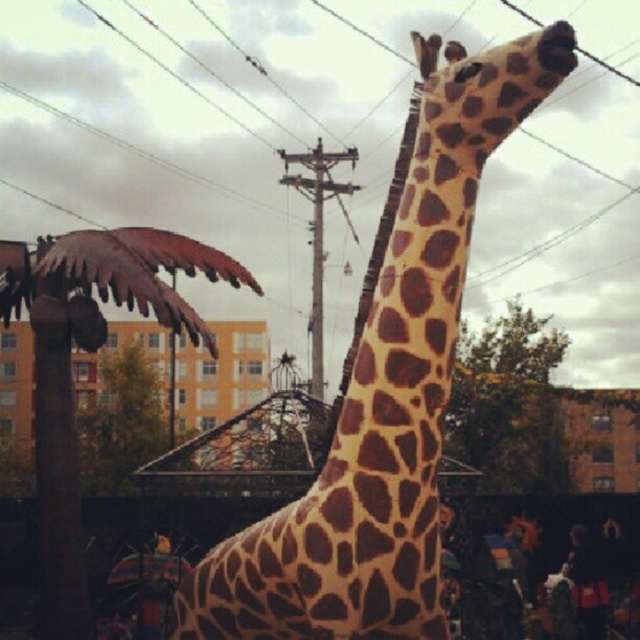
Question: Does metallic brown palm tree at left have a smaller size compared to green leafy tree at upper right?

Choices:
 (A) yes
 (B) no

Answer: (B)

Question: Is the position of spotted fabric giraffe at center less distant than that of metallic brown palm tree at left?

Choices:
 (A) no
 (B) yes

Answer: (B)

Question: Is metallic brown palm tree at left to the right of green leafy tree at upper right from the viewer's perspective?

Choices:
 (A) yes
 (B) no

Answer: (B)

Question: Based on their relative distances, which object is farther from the spotted fabric giraffe at center?

Choices:
 (A) metallic brown palm tree at left
 (B) green leafy tree at upper right

Answer: (B)

Question: Which object appears closest to the camera in this image?

Choices:
 (A) green leafy tree at upper right
 (B) spotted fabric giraffe at center
 (C) metallic brown palm tree at left

Answer: (B)

Question: Which point is closer to the camera taking this photo?

Choices:
 (A) (36, 448)
 (B) (400, 336)
 (C) (504, 435)

Answer: (B)